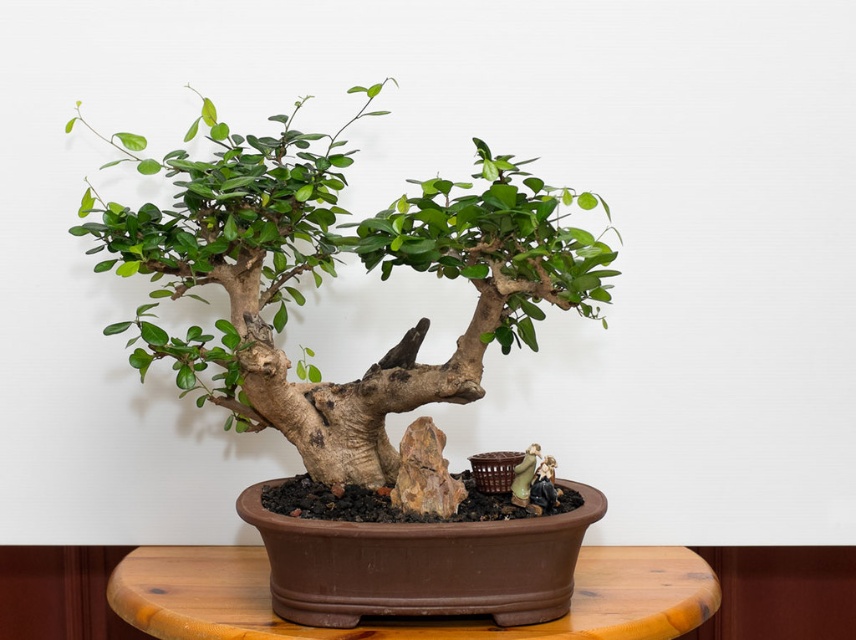
You are a gardener who needs to water the green matte bonsai tree at center. Your watering can has a maximum reach of 36 inches. Can you reach the bonsai tree without moving closer?

The green matte bonsai tree at center is 35.90 inches away from the viewer, which is within the watering can reach of 36 inches. Therefore, you can reach the bonsai tree without moving closer.

You are a gardener who wants to place a decorative stone on the brown wooden table at center. The stone has a diameter of 12 inches. Considering the green matte bonsai tree at center is already on the table, will the stone fit on the remaining space?

The distance of green matte bonsai tree at center from brown wooden table at center is 13.81 inches. Since the stone has a diameter of 12 inches, which is smaller than the distance between the tree and the edge of the table, the stone can be placed on the remaining space of the brown wooden table at center.